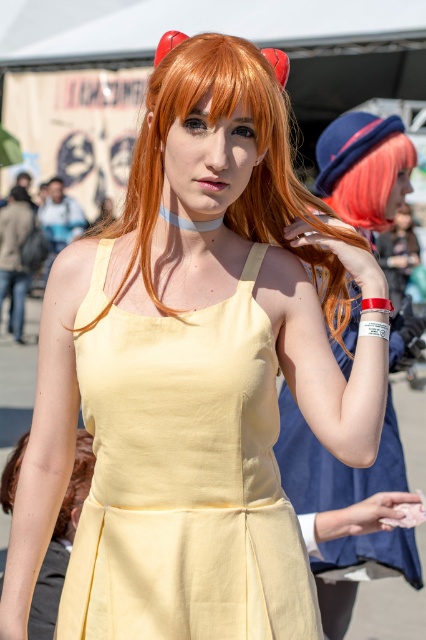
Consider the image. You are standing at the origin of the coordinate system in the image. You see two points marked in the scene, one at point (290, 392) and the other at point (39, 605). Which point is closer to you?

Point (39, 605) is closer to you because it is in front of point (290, 392) according to their spatial relationship.

You are a photographer at a cosplay event and need to capture a clear photo of the yellow fabric dress at center and the matte yellow dress at center. Which dress should you focus on to ensure it appears sharp in the photo?

You should focus on the yellow fabric dress at center because it is closer to the viewer than the matte yellow dress at center, so focusing on it will keep it sharp while the background may blur slightly.

You are a photographer at a cosplay event. You need to position the person with shiny orange hair at center and the person with shiny pink wig at upper right in a group photo. Which person should stand on the left side of the group photo to match their current positions?

The shiny orange hair at center should stand on the left side of the group photo because it is currently to the left of the shiny pink wig at upper right.